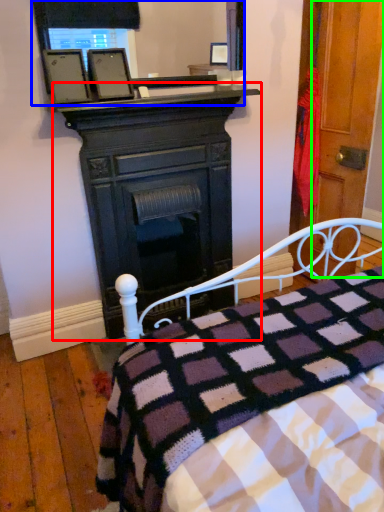
Question: Which is nearer to the desk (highlighted by a red box)? mirror (highlighted by a blue box) or door (highlighted by a green box).

Choices:
 (A) mirror
 (B) door

Answer: (A)